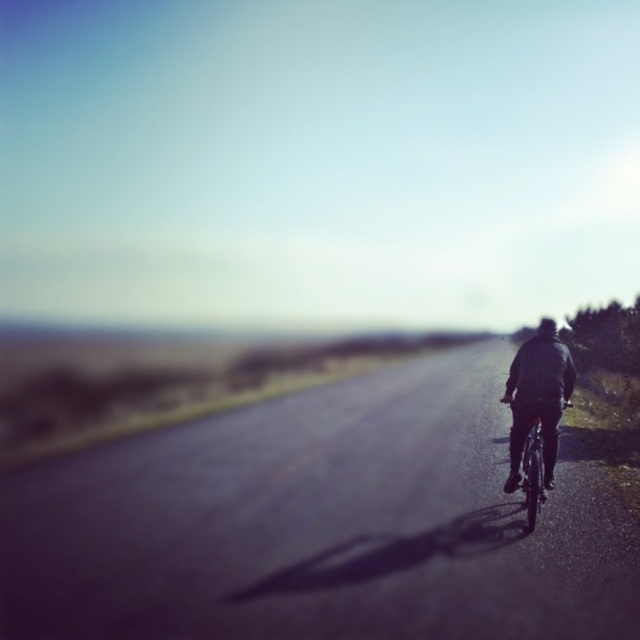
You are a cyclist planning to ride along the road shown in the image. You notice the metallic silver bicycle at center and the dark gray jacket at right. Which object is closer to you from your current viewpoint?

The dark gray jacket at right is closer to you because the metallic silver bicycle at center is behind it.

You are a photographer positioned at the center of the image. You want to capture a photo of the cyclist and the dark gray jacket at right. Based on their positions, will the jacket appear to the left or right of the cyclist in the photo?

The dark gray jacket at right is located at point (538,397), which places it to the right side of the image. Since the cyclist is positioned centrally, the jacket will appear to the right of the cyclist in the photo.

You are a photographer wanting to capture the metallic silver bicycle at center and the dark gray jacket at right in the same frame. Since you want both objects to appear equally prominent, which object should you move closer to?

You should move closer to the dark gray jacket at right because it is smaller than the metallic silver bicycle at center, making them appear more balanced in size within the frame.